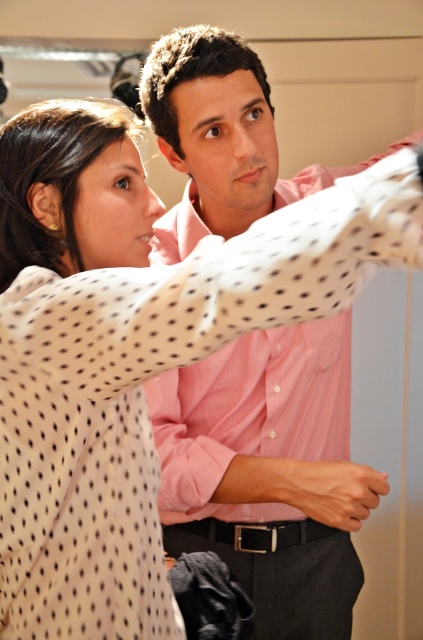
You are standing in the scene and see the point marked at coordinates (99, 365). What object is located at that point?

The polka dot blouse at upper left is located at point (99, 365).

You are a fashion designer observing the scene. You notice the polka dot blouse at upper left and the pink cotton shirt at center. Which clothing item is bigger in size?

The polka dot blouse at upper left has a larger size compared to the pink cotton shirt at center, so the polka dot blouse at upper left is bigger.

You are a photographer setting up for a group photo. You need to position the polka dot blouse at upper left and the pink cotton shirt at center so that they align properly in the frame. Based on their current positions, which clothing item is higher up in the image?

The polka dot blouse at upper left is located above the pink cotton shirt at center, so it is higher up in the image.